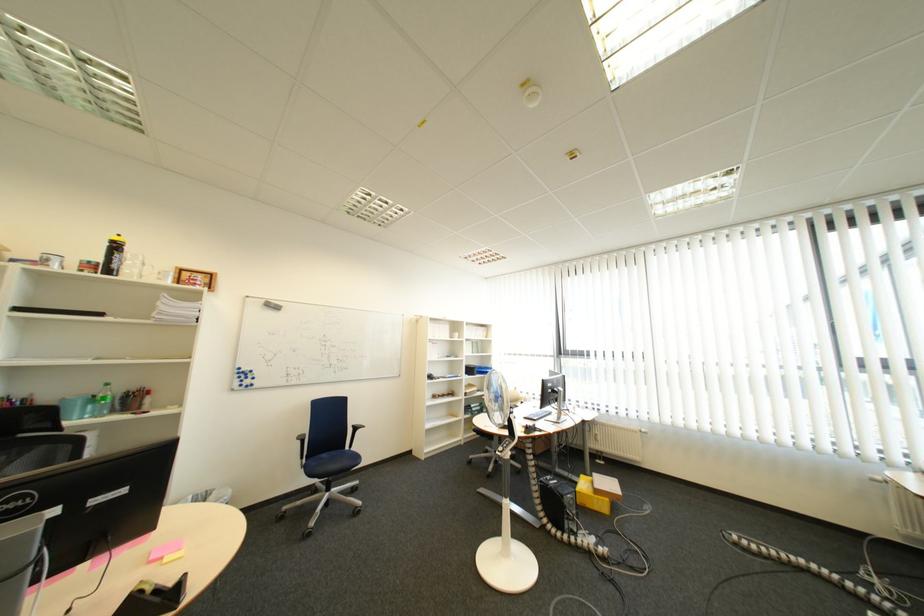
You are a GUI agent. You are given a task and a screenshot of the screen. Output one action in this format:
    pyautogui.click(x=<x>, y=<y>)
    Task: Click on the black water bottle
    Image resolution: width=924 pixels, height=616 pixels.
    Given the screenshot: What is the action you would take?
    pyautogui.click(x=113, y=256)